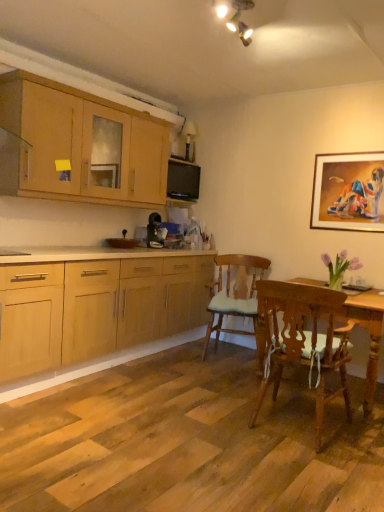
Question: Is black glossy microwave oven at upper center thinner than light wood cabinet at upper left?

Choices:
 (A) no
 (B) yes

Answer: (B)

Question: Does black glossy microwave oven at upper center lie in front of light wood cabinet at upper left?

Choices:
 (A) no
 (B) yes

Answer: (A)

Question: From the image's perspective, is black glossy microwave oven at upper center over light wood cabinet at upper left?

Choices:
 (A) yes
 (B) no

Answer: (B)

Question: From the image's perspective, is black glossy microwave oven at upper center located beneath light wood cabinet at upper left?

Choices:
 (A) no
 (B) yes

Answer: (B)

Question: Is black glossy microwave oven at upper center taller than light wood cabinet at upper left?

Choices:
 (A) no
 (B) yes

Answer: (A)

Question: Is wooden chair with cushion at center, the 1th chair when ordered from back to front, wider or thinner than gold-framed painting at upper right?

Choices:
 (A) thin
 (B) wide

Answer: (B)

Question: Is wooden chair with cushion at center, positioned as the 2th chair in front-to-back order, bigger or smaller than gold-framed painting at upper right?

Choices:
 (A) small
 (B) big

Answer: (B)

Question: Is wooden chair with cushion at center, the 1th chair when ordered from back to front, taller or shorter than gold-framed painting at upper right?

Choices:
 (A) short
 (B) tall

Answer: (B)

Question: Considering the positions of point (220, 302) and point (319, 163), is point (220, 302) closer or farther from the camera than point (319, 163)?

Choices:
 (A) closer
 (B) farther

Answer: (A)

Question: From a real-world perspective, is wooden chair with cushion at center, the 1th chair when ordered from back to front, physically located above or below black glossy microwave oven at upper center?

Choices:
 (A) above
 (B) below

Answer: (B)

Question: Considering the relative positions of wooden chair with cushion at center, the 1th chair when ordered from back to front, and black glossy microwave oven at upper center in the image provided, is wooden chair with cushion at center, the 1th chair when ordered from back to front, to the left or to the right of black glossy microwave oven at upper center?

Choices:
 (A) left
 (B) right

Answer: (B)

Question: From their relative heights in the image, would you say wooden chair with cushion at center, the 1th chair when ordered from back to front, is taller or shorter than black glossy microwave oven at upper center?

Choices:
 (A) short
 (B) tall

Answer: (B)

Question: Is wooden chair with cushion at center, the 1th chair when ordered from back to front, in front of or behind black glossy microwave oven at upper center in the image?

Choices:
 (A) front
 (B) behind

Answer: (A)

Question: In terms of size, does wooden chair with cushion at center, positioned as the 2th chair in front-to-back order, appear bigger or smaller than wooden chair with white cushion at lower right, marked as the second chair in a back-to-front arrangement?

Choices:
 (A) big
 (B) small

Answer: (A)

Question: From a real-world perspective, relative to wooden chair with white cushion at lower right, placed as the first chair when sorted from front to back, is wooden chair with cushion at center, positioned as the 2th chair in front-to-back order, vertically above or below?

Choices:
 (A) above
 (B) below

Answer: (A)